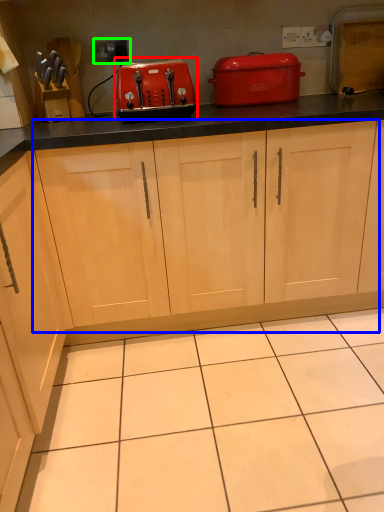
Question: Estimate the real-world distances between objects in this image. Which object is farther from kitchen appliance (highlighted by a red box), cabinetry (highlighted by a blue box) or electric outlet (highlighted by a green box)?

Choices:
 (A) cabinetry
 (B) electric outlet

Answer: (B)